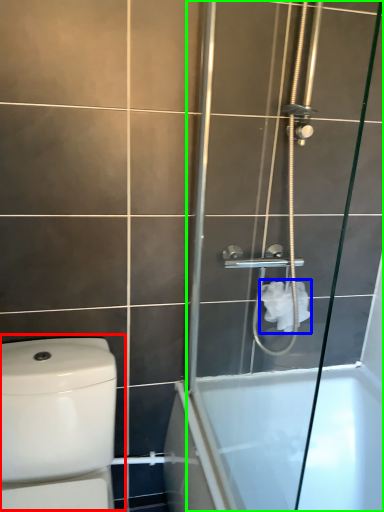
Question: Considering the real-world distances, which object is closest to toilet (highlighted by a red box)? toilet paper (highlighted by a blue box) or screen door (highlighted by a green box).

Choices:
 (A) toilet paper
 (B) screen door

Answer: (B)